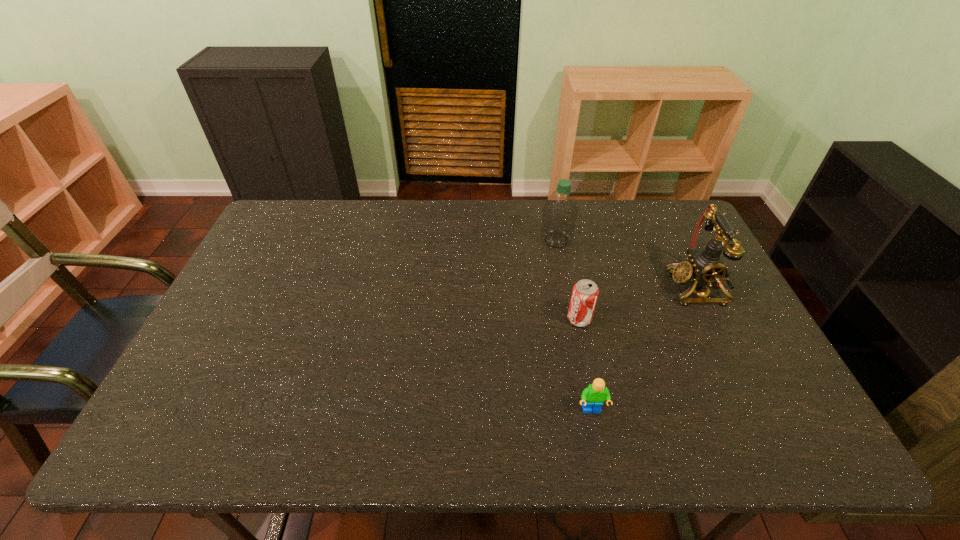
Where is `free space located 0.050m on the face of the nearest object`? The width and height of the screenshot is (960, 540). free space located 0.050m on the face of the nearest object is located at coordinates (597, 438).

Locate an element on the screen. This screenshot has height=540, width=960. object located at the far edge is located at coordinates click(x=560, y=211).

At what (x,y) coordinates should I click in order to perform the action: click on object present at the near edge. Please return your answer as a coordinate pair (x, y). Image resolution: width=960 pixels, height=540 pixels. Looking at the image, I should click on (592, 397).

This screenshot has height=540, width=960. Identify the location of object that is positioned at the right edge. (705, 267).

Where is `free space at the far edge`? The height and width of the screenshot is (540, 960). free space at the far edge is located at coordinates (540, 233).

Where is `vacant area at the near edge of the desktop`? This screenshot has width=960, height=540. vacant area at the near edge of the desktop is located at coordinates (396, 420).

Where is `free space at the left edge of the desktop`? free space at the left edge of the desktop is located at coordinates (254, 278).

You are a GUI agent. You are given a task and a screenshot of the screen. Output one action in this format:
    pyautogui.click(x=<x>, y=<y>)
    Task: Click on the free spot at the near left corner of the desktop
    The height and width of the screenshot is (540, 960).
    Given the screenshot: What is the action you would take?
    pyautogui.click(x=171, y=424)

Locate an element on the screen. This screenshot has width=960, height=540. free space at the far right corner of the desktop is located at coordinates (655, 217).

This screenshot has width=960, height=540. I want to click on vacant area that lies between the telephone and the soda can, so click(x=637, y=303).